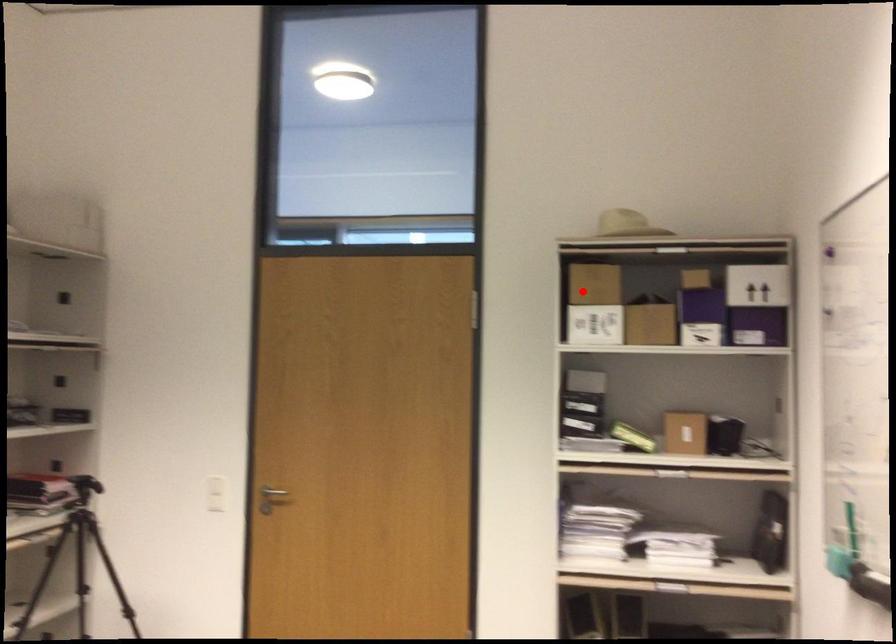
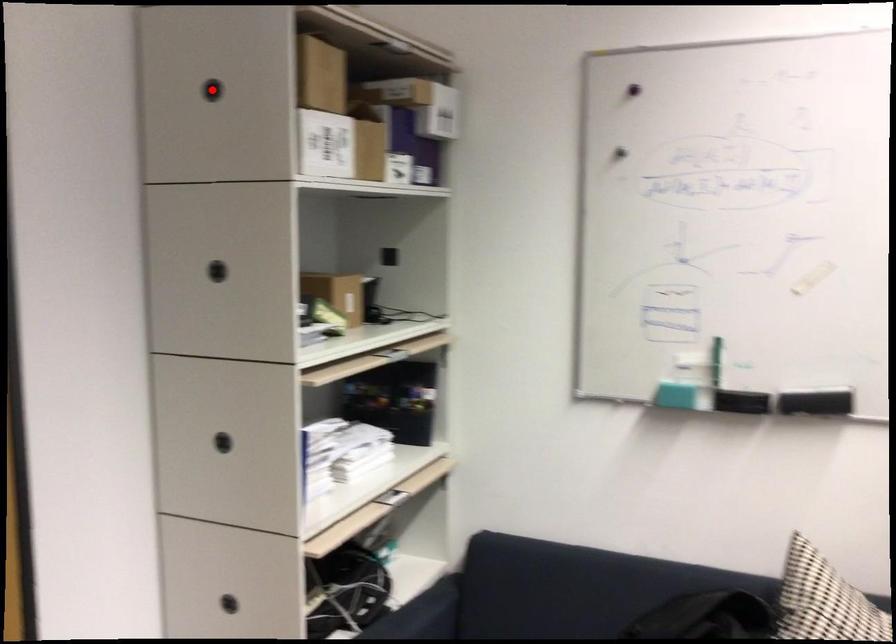
I am providing you with two images of the same scene from different viewpoints. A red point is marked on the first image and another point is marked on the second image. Is the marked point in image1 the same physical position as the marked point in image2?

Yes